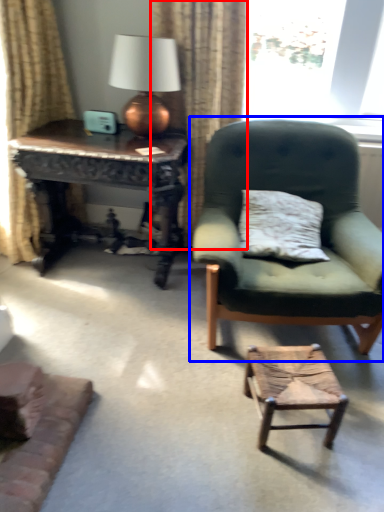
Question: Which of the following is the closest to the observer, curtain (highlighted by a red box) or chair (highlighted by a blue box)?

Choices:
 (A) curtain
 (B) chair

Answer: (B)